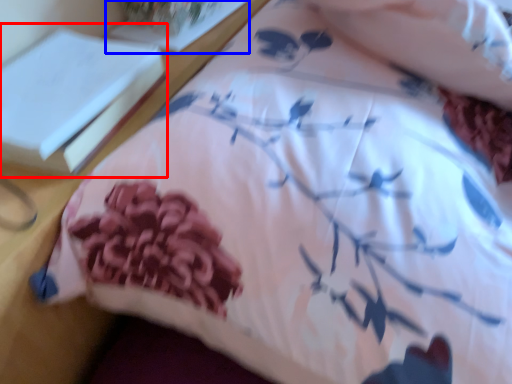
Question: Which object appears closest to the camera in this image, book (highlighted by a red box) or book (highlighted by a blue box)?

Choices:
 (A) book
 (B) book

Answer: (A)